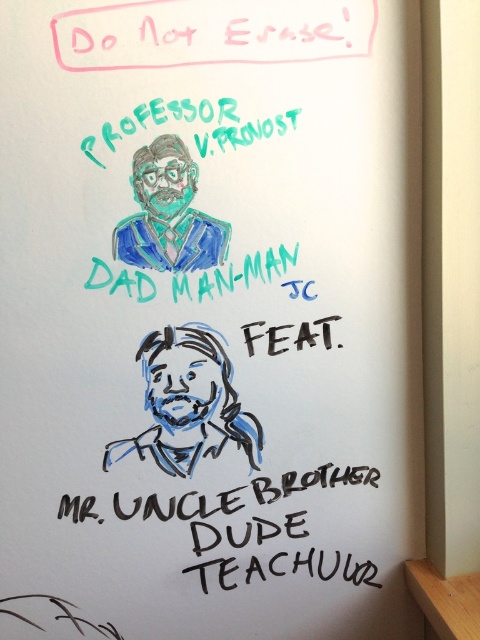
Question: Is blue sketchy man at center bigger than teal matte suit at upper center?

Choices:
 (A) yes
 (B) no

Answer: (A)

Question: Which is nearer to the teal matte suit at upper center?

Choices:
 (A) black marker text at lower center
 (B) blue sketchy man at center

Answer: (B)

Question: Which point is closer to the camera?

Choices:
 (A) tap(364, 570)
 (B) tap(179, 141)
 (C) tap(191, 460)

Answer: (B)

Question: Does blue sketchy man at center appear on the left side of black marker text at lower center?

Choices:
 (A) yes
 (B) no

Answer: (A)

Question: Does blue sketchy man at center have a larger size compared to black marker text at lower center?

Choices:
 (A) yes
 (B) no

Answer: (B)

Question: Which point is closer to the camera?

Choices:
 (A) black marker text at lower center
 (B) teal matte suit at upper center
 (C) blue sketchy man at center

Answer: (B)